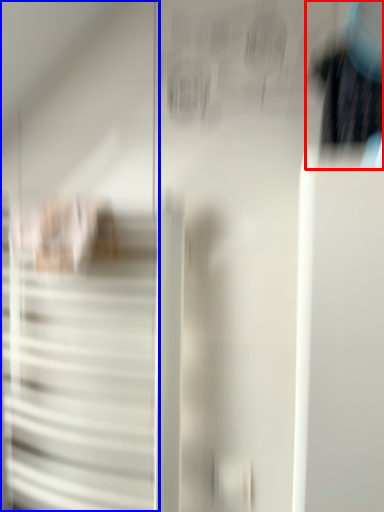
Question: Which point is further to the camera, couple (highlighted by a red box) or door (highlighted by a blue box)?

Choices:
 (A) couple
 (B) door

Answer: (B)